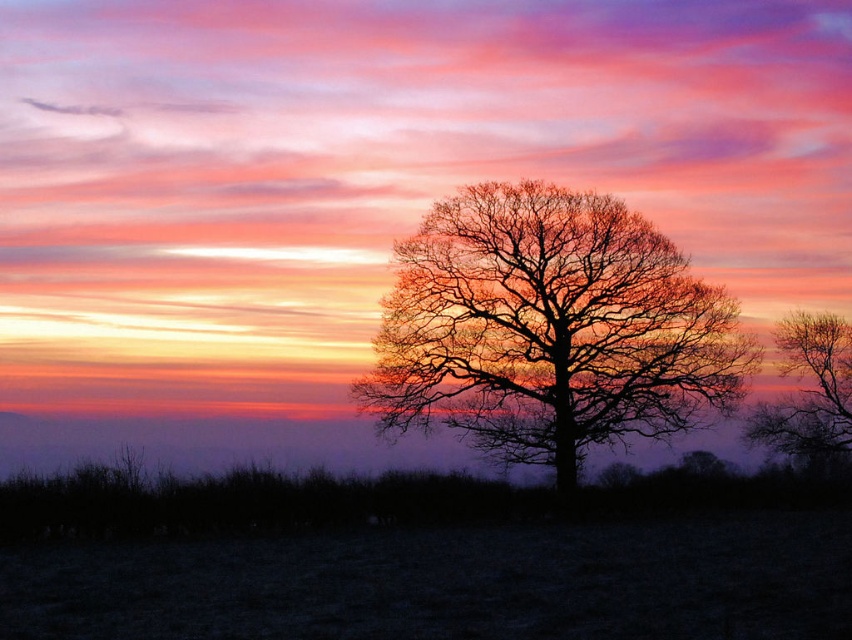
This screenshot has width=852, height=640. Describe the element at coordinates (550, 328) in the screenshot. I see `bare branches at center` at that location.

Who is more distant from viewer, [655,296] or [842,422]?

The point [842,422] is behind.

Between point (626, 234) and point (790, 346), which one is positioned behind?

The point (790, 346) is more distant.

Locate an element on the screen. Image resolution: width=852 pixels, height=640 pixels. bare branches at center is located at coordinates (550, 328).